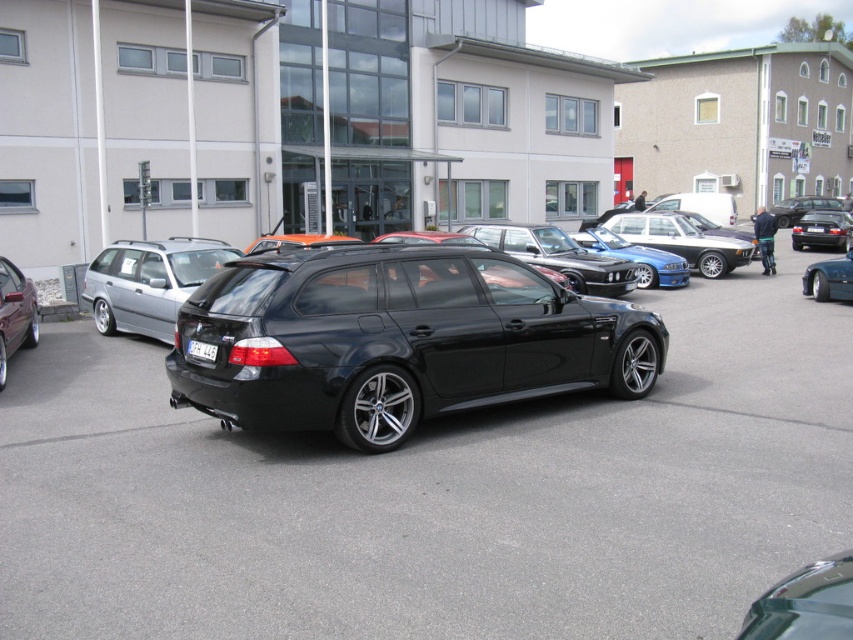
Can you confirm if black metallic car at center is positioned below white plastic license plate at center?

Yes.

Looking at this image, does black metallic car at center have a smaller size compared to white plastic license plate at center?

Actually, black metallic car at center might be larger than white plastic license plate at center.

You are a GUI agent. You are given a task and a screenshot of the screen. Output one action in this format:
    pyautogui.click(x=<x>, y=<y>)
    Task: Click on the black metallic car at center
    The image size is (853, 640).
    Given the screenshot: What is the action you would take?
    pyautogui.click(x=436, y=493)

Where is `black metallic car at center`? This screenshot has width=853, height=640. black metallic car at center is located at coordinates (436, 493).

Is black metallic car at center above glossy black sedan at center?

No.

Can you confirm if black metallic car at center is taller than glossy black sedan at center?

Yes.

Between point (50, 596) and point (543, 227), which one is positioned behind?

The point (543, 227) is behind.

At what (x,y) coordinates should I click in order to perform the action: click on black metallic car at center. Please return your answer as a coordinate pair (x, y). This screenshot has height=640, width=853. Looking at the image, I should click on (436, 493).

Does glossy black sedan at center appear under shiny blue sedan at center?

Indeed, glossy black sedan at center is positioned under shiny blue sedan at center.

Between point (567, 276) and point (689, 253), which one is positioned behind?

Point (689, 253)

In order to click on glossy black sedan at center in this screenshot , I will do `click(560, 256)`.